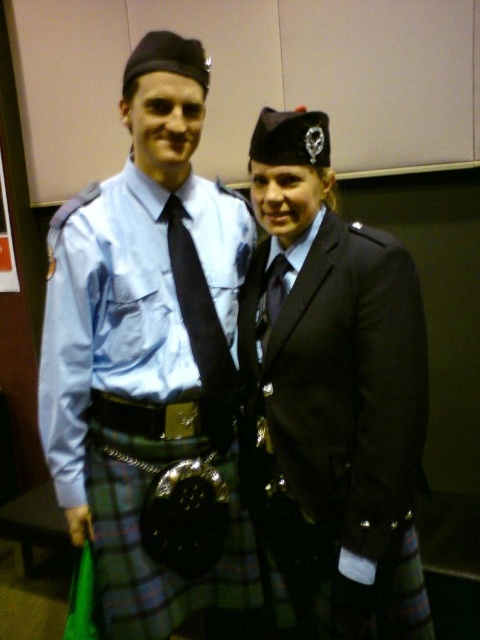
Question: Which of these objects is positioned closest to the black satin kilt at center?

Choices:
 (A) matte blue shirt at center
 (B) black silk tie at center
 (C) matte black tie at center

Answer: (B)

Question: Does matte blue shirt at center have a lesser width compared to matte black tie at center?

Choices:
 (A) no
 (B) yes

Answer: (A)

Question: Which object is farther from the camera taking this photo?

Choices:
 (A) matte blue shirt at center
 (B) matte black tie at center
 (C) black satin kilt at center
 (D) black silk tie at center

Answer: (D)

Question: Does black silk tie at center have a lesser width compared to matte black tie at center?

Choices:
 (A) yes
 (B) no

Answer: (B)

Question: Which of the following is the closest to the observer?

Choices:
 (A) (297, 472)
 (B) (176, 577)
 (C) (259, 362)
 (D) (175, 195)

Answer: (A)

Question: Considering the relative positions of black satin kilt at center and black silk tie at center in the image provided, where is black satin kilt at center located with respect to black silk tie at center?

Choices:
 (A) below
 (B) above

Answer: (A)